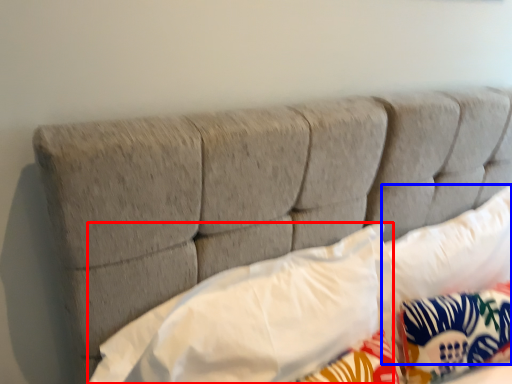
Question: Among these objects, which one is nearest to the camera, pillow (highlighted by a red box) or pillow (highlighted by a blue box)?

Choices:
 (A) pillow
 (B) pillow

Answer: (A)